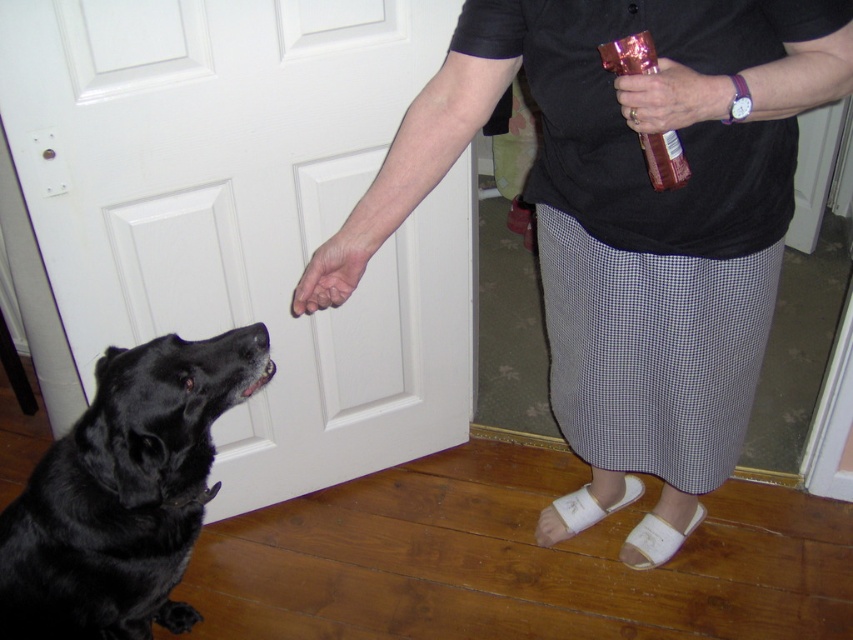
Who is positioned more to the right, matte black skirt at center or metallic pink can at upper right?

matte black skirt at center is more to the right.

Is the position of matte black skirt at center less distant than that of metallic pink can at upper right?

That is False.

At what (x,y) coordinates should I click in order to perform the action: click on matte black skirt at center. Please return your answer as a coordinate pair (x, y). The width and height of the screenshot is (853, 640). Looking at the image, I should click on (637, 227).

This screenshot has height=640, width=853. I want to click on matte black skirt at center, so click(x=637, y=227).

Looking at this image, does white matte door at center appear on the right side of black fur dog at left?

Yes, white matte door at center is to the right of black fur dog at left.

Who is positioned more to the right, white matte door at center or black fur dog at left?

From the viewer's perspective, white matte door at center appears more on the right side.

Between point (218, 292) and point (49, 467), which one is positioned behind?

The point (218, 292) is more distant.

Identify the location of white matte door at center. (247, 212).

Does white matte door at center appear over dry skin at center?

Yes.

Who is shorter, white matte door at center or dry skin at center?

Standing shorter between the two is dry skin at center.

You are a GUI agent. You are given a task and a screenshot of the screen. Output one action in this format:
    pyautogui.click(x=<x>, y=<y>)
    Task: Click on the white matte door at center
    Image resolution: width=853 pixels, height=640 pixels.
    Given the screenshot: What is the action you would take?
    pyautogui.click(x=247, y=212)